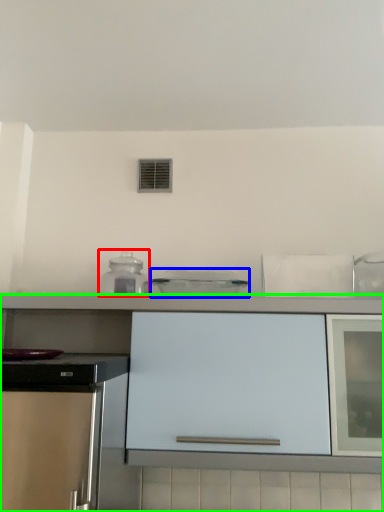
Question: Which object is the farthest from kitchen appliance (highlighted by a red box)? Choose among these: kitchen appliance (highlighted by a blue box) or cabinetry (highlighted by a green box).

Choices:
 (A) kitchen appliance
 (B) cabinetry

Answer: (B)